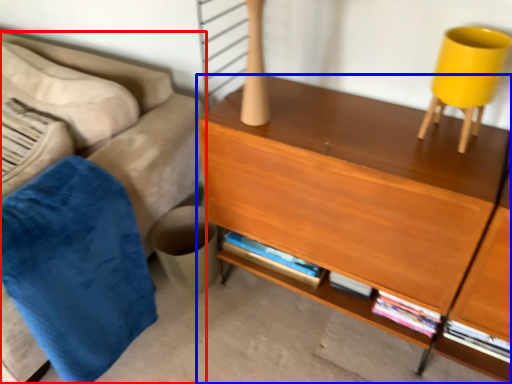
Question: Among these objects, which one is farthest to the camera, studio couch (highlighted by a red box) or desk (highlighted by a blue box)?

Choices:
 (A) studio couch
 (B) desk

Answer: (A)